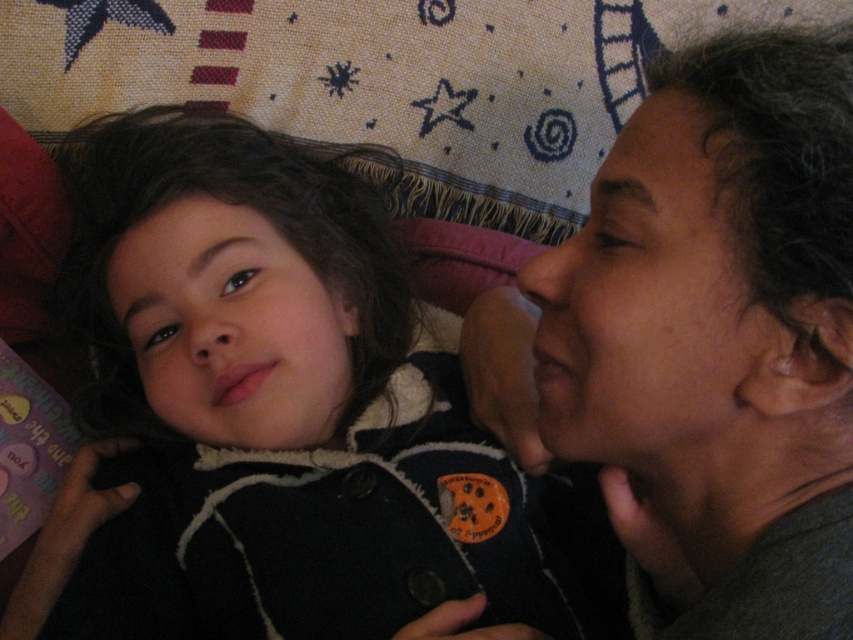
Question: Can you confirm if dark gray hair at right is positioned to the left of smooth skin face at center?

Choices:
 (A) yes
 (B) no

Answer: (B)

Question: Which point is farther to the camera?

Choices:
 (A) smooth skin face at right
 (B) dark gray hair at right
 (C) smooth skin face at center
 (D) dark blue fleece jacket at center

Answer: (C)

Question: Among these objects, which one is farthest from the camera?

Choices:
 (A) dark blue fleece jacket at center
 (B) smooth skin face at center
 (C) smooth skin face at right
 (D) dark gray hair at right

Answer: (B)

Question: Among these objects, which one is nearest to the camera?

Choices:
 (A) smooth skin face at center
 (B) dark blue fleece jacket at center
 (C) dark gray hair at right
 (D) smooth skin face at right

Answer: (C)

Question: Is the position of dark blue fleece jacket at center more distant than that of dark gray hair at right?

Choices:
 (A) no
 (B) yes

Answer: (B)

Question: From the image, what is the correct spatial relationship of dark blue fleece jacket at center in relation to smooth skin face at center?

Choices:
 (A) below
 (B) above

Answer: (A)